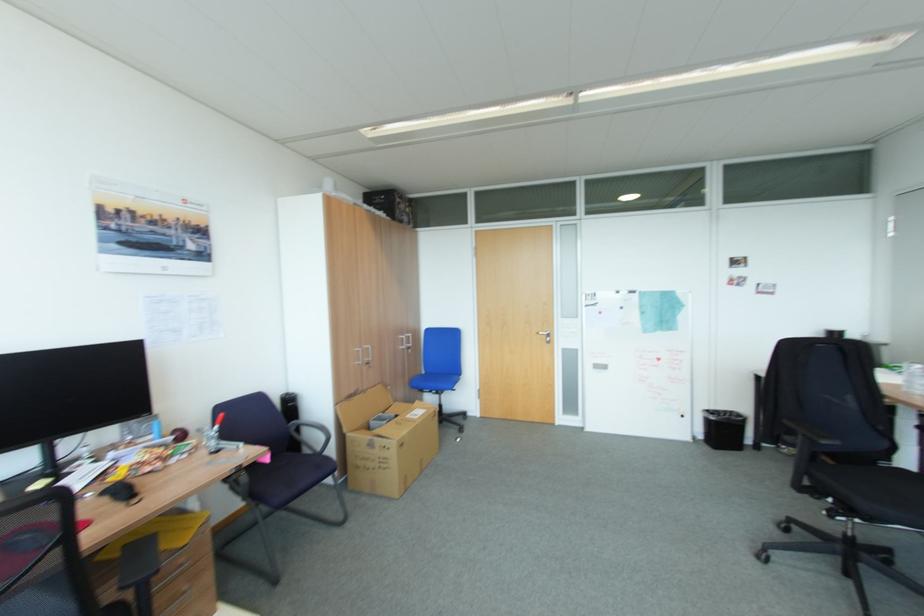
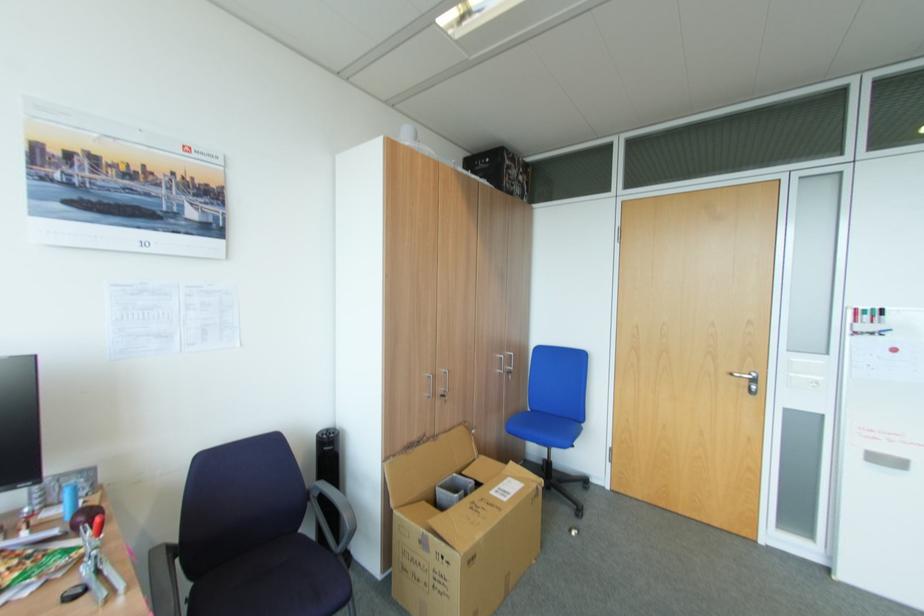
Locate, in the second image, the point that corresponds to the point at 408,349 in the first image.

(505, 371)